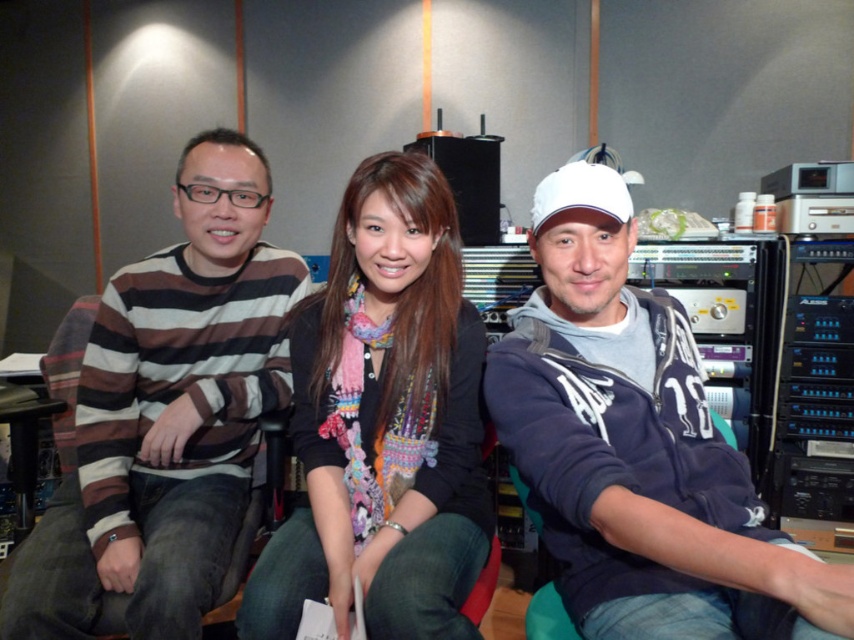
Question: Can you confirm if striped cotton sweater at left is bigger than multicolored knitted scarf at center?

Choices:
 (A) no
 (B) yes

Answer: (B)

Question: Does white matte baseball cap at upper right appear on the right side of multicolored knitted scarf at center?

Choices:
 (A) no
 (B) yes

Answer: (B)

Question: Which point is closer to the camera taking this photo?

Choices:
 (A) (436, 614)
 (B) (206, 298)
 (C) (600, 168)

Answer: (A)

Question: Which object is farther from the camera taking this photo?

Choices:
 (A) white matte baseball cap at upper right
 (B) striped cotton sweater at left

Answer: (B)

Question: Which object appears closest to the camera in this image?

Choices:
 (A) multicolored knitted scarf at center
 (B) white matte baseball cap at upper right

Answer: (B)

Question: Does white matte baseball cap at upper right appear on the right side of multicolored knitted scarf at center?

Choices:
 (A) no
 (B) yes

Answer: (B)